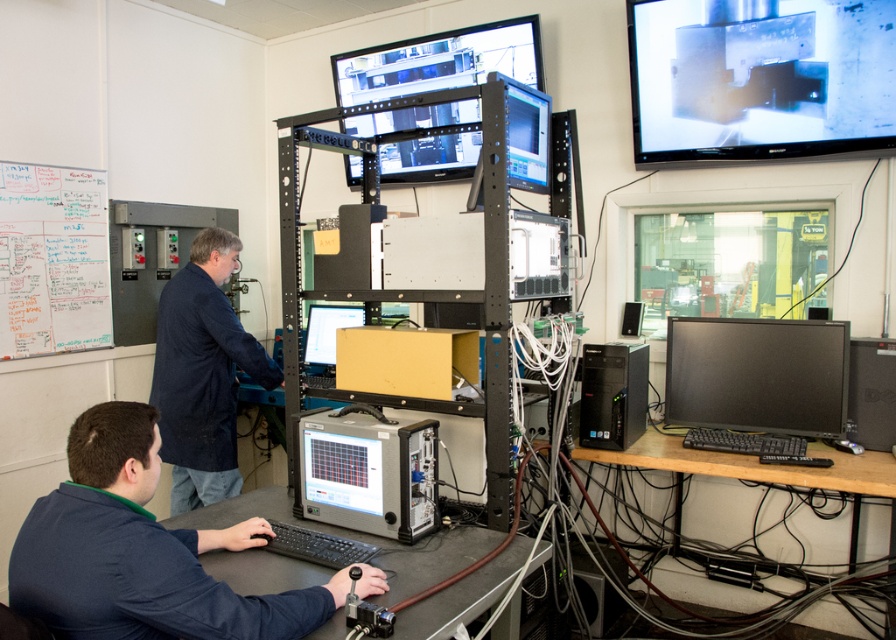
Question: Does metallic silver monitor at upper right have a larger size compared to black matte monitor at lower right?

Choices:
 (A) no
 (B) yes

Answer: (B)

Question: Among these objects, which one is farthest from the camera?

Choices:
 (A) matte black monitor at center
 (B) whiteboard at left

Answer: (A)

Question: Can you confirm if dark blue fabric at left is positioned below black matte monitor at lower right?

Choices:
 (A) no
 (B) yes

Answer: (B)

Question: Does whiteboard at left appear on the right side of black plastic computer tower at center?

Choices:
 (A) no
 (B) yes

Answer: (A)

Question: Which point is farther to the camera?

Choices:
 (A) whiteboard at left
 (B) dark blue fabric at left
 (C) matte black monitor at center

Answer: (C)

Question: Estimate the real-world distances between objects in this image. Which object is farther from the black plastic computer tower at center?

Choices:
 (A) matte black monitor at upper center
 (B) matte black monitor at center
 (C) gray metallic computer at center
 (D) whiteboard at left

Answer: (D)